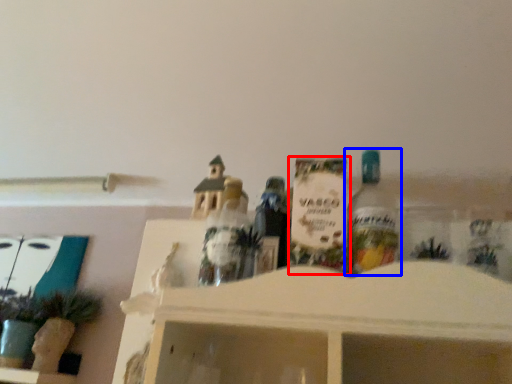
Question: Which object is closer to the camera taking this photo, toy (highlighted by a red box) or bottle (highlighted by a blue box)?

Choices:
 (A) toy
 (B) bottle

Answer: (B)